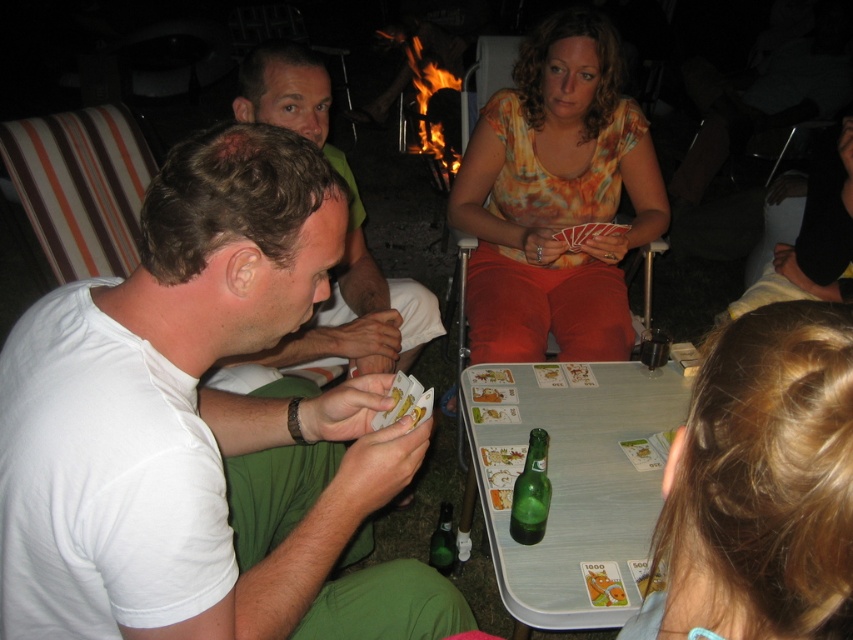
Is matte green shirt at center to the right of green glass bottle at center from the viewer's perspective?

In fact, matte green shirt at center is to the left of green glass bottle at center.

Does point (309, 326) come closer to viewer compared to point (537, 486)?

That is False.

I want to click on matte green shirt at center, so click(x=341, y=256).

Looking at this image, is the position of green glass bottle at center more distant than that of green glass bottle at lower center?

No, green glass bottle at center is closer to the viewer.

Identify the location of green glass bottle at center. [531, 492].

Can you confirm if orange tie-dye shirt at center is positioned above matte green shirt at center?

Yes, orange tie-dye shirt at center is above matte green shirt at center.

Can you confirm if orange tie-dye shirt at center is thinner than matte green shirt at center?

No, orange tie-dye shirt at center is not thinner than matte green shirt at center.

Between point (550, 170) and point (338, 288), which one is positioned behind?

Point (550, 170)

Find the location of a particular element. Image resolution: width=853 pixels, height=640 pixels. orange tie-dye shirt at center is located at coordinates (555, 198).